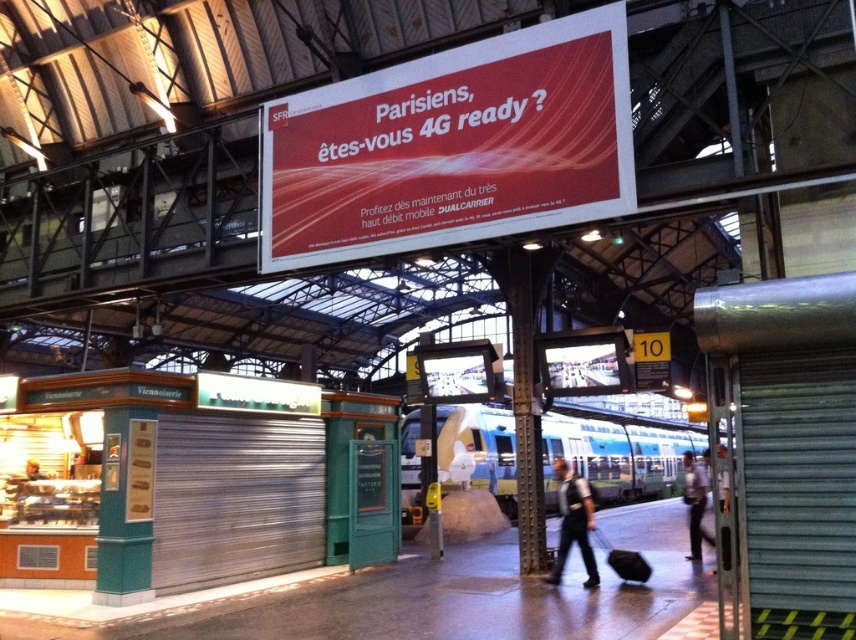
Which of these two, light blue metallic train at center or light blue shirt at right, stands shorter?

Standing shorter between the two is light blue shirt at right.

What do you see at coordinates (615, 456) in the screenshot? I see `light blue metallic train at center` at bounding box center [615, 456].

Between point (628, 435) and point (705, 486), which one is positioned in front?

Point (705, 486) is in front.

I want to click on light blue metallic train at center, so tap(615, 456).

Is matte red billboard at center to the right of light blue shirt at right from the viewer's perspective?

In fact, matte red billboard at center is to the left of light blue shirt at right.

Is matte red billboard at center thinner than light blue shirt at right?

Correct, matte red billboard at center's width is less than light blue shirt at right's.

Who is more forward, (455, 193) or (700, 477)?

Positioned in front is point (455, 193).

You are a GUI agent. You are given a task and a screenshot of the screen. Output one action in this format:
    pyautogui.click(x=<x>, y=<y>)
    Task: Click on the matte red billboard at center
    
    Given the screenshot: What is the action you would take?
    pos(452,147)

Is matte red billboard at center positioned in front of dark blue uniform at center?

Yes, it is.

Describe the element at coordinates (452, 147) in the screenshot. I see `matte red billboard at center` at that location.

Where is `matte red billboard at center`? The image size is (856, 640). matte red billboard at center is located at coordinates pos(452,147).